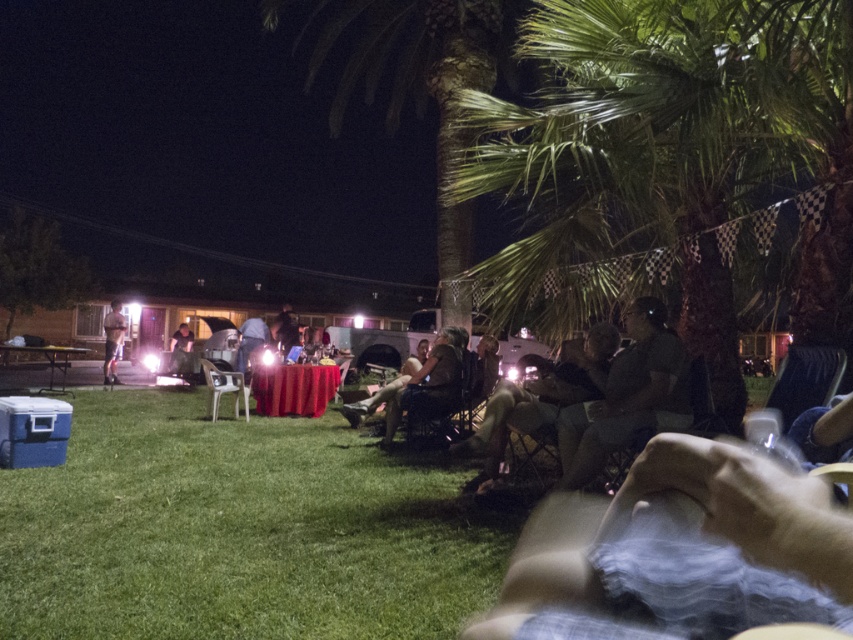
Measure the distance from matte black chair at center to matte black shirt at center.

matte black chair at center is 5.06 meters from matte black shirt at center.

Based on the photo, who is higher up, matte black chair at center or matte black shirt at center?

matte black shirt at center is above.

Is point (370, 396) farther from camera compared to point (247, 337)?

No, (370, 396) is in front of (247, 337).

This screenshot has height=640, width=853. I want to click on matte black chair at center, so click(x=387, y=387).

Describe the element at coordinates (428, 381) in the screenshot. I see `brown fabric chair at center` at that location.

Does brown fabric chair at center have a greater height compared to matte black shirt at center?

Correct, brown fabric chair at center is much taller as matte black shirt at center.

Locate an element on the screen. brown fabric chair at center is located at coordinates coord(428,381).

Find the location of a particular element. The image size is (853, 640). brown fabric chair at center is located at coordinates (428, 381).

Is green leafy palm tree at upper right to the right of dark green fabric chair at center right from the viewer's perspective?

Indeed, green leafy palm tree at upper right is positioned on the right side of dark green fabric chair at center right.

You are a GUI agent. You are given a task and a screenshot of the screen. Output one action in this format:
    pyautogui.click(x=<x>, y=<y>)
    Task: Click on the green leafy palm tree at upper right
    
    Given the screenshot: What is the action you would take?
    pyautogui.click(x=670, y=156)

Is point (500, 100) in front of point (607, 381)?

No, (500, 100) is behind (607, 381).

You are a GUI agent. You are given a task and a screenshot of the screen. Output one action in this format:
    pyautogui.click(x=<x>, y=<y>)
    Task: Click on the green leafy palm tree at upper right
    
    Given the screenshot: What is the action you would take?
    pyautogui.click(x=670, y=156)